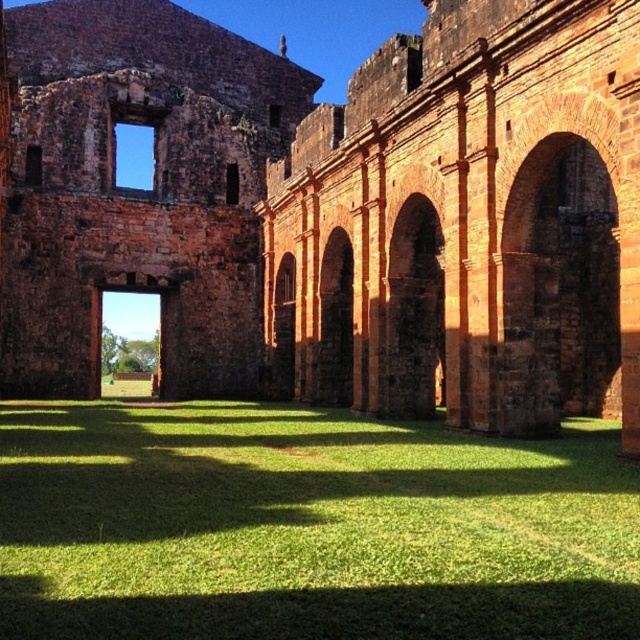
In the scene shown: Between brown stone arches at center and red brick archway at center, which one has less height?

red brick archway at center

Locate an element on the screen. The height and width of the screenshot is (640, 640). brown stone arches at center is located at coordinates (332, 204).

Is brown stone arches at center bigger than brown stone archway at center?

Correct, brown stone arches at center is larger in size than brown stone archway at center.

Describe the element at coordinates (332, 204) in the screenshot. I see `brown stone arches at center` at that location.

The width and height of the screenshot is (640, 640). Identify the location of brown stone arches at center. (332, 204).

How far apart are green grass at center and red brick archway at center?

green grass at center and red brick archway at center are 25.62 meters apart.

Can you confirm if green grass at center is thinner than red brick archway at center?

Incorrect, green grass at center's width is not less than red brick archway at center's.

Find the location of a particular element. This screenshot has height=640, width=640. green grass at center is located at coordinates (307, 525).

Locate an element on the screen. The height and width of the screenshot is (640, 640). green grass at center is located at coordinates (307, 525).